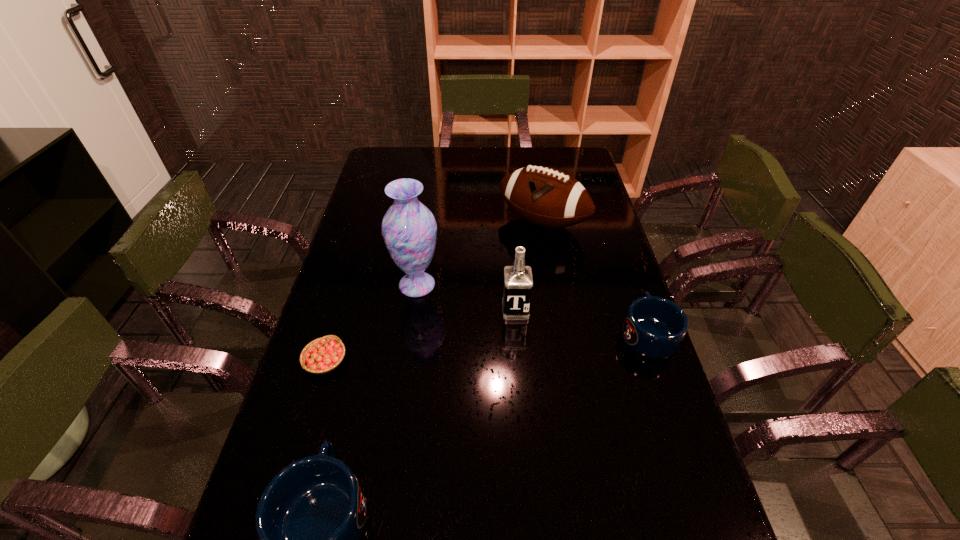
You are a GUI agent. You are given a task and a screenshot of the screen. Output one action in this format:
    pyautogui.click(x=<x>, y=<y>)
    Task: Click on the vacant position for inserting another mug evenly
    Image resolution: width=960 pixels, height=540 pixels.
    Given the screenshot: What is the action you would take?
    pyautogui.click(x=512, y=409)